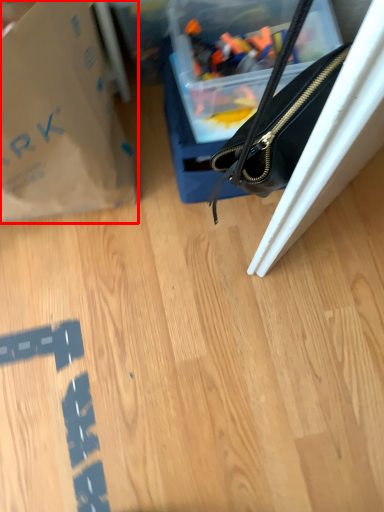
Question: In this image, where is tote bag (annotated by the red box) located relative to handbag?

Choices:
 (A) left
 (B) right

Answer: (A)